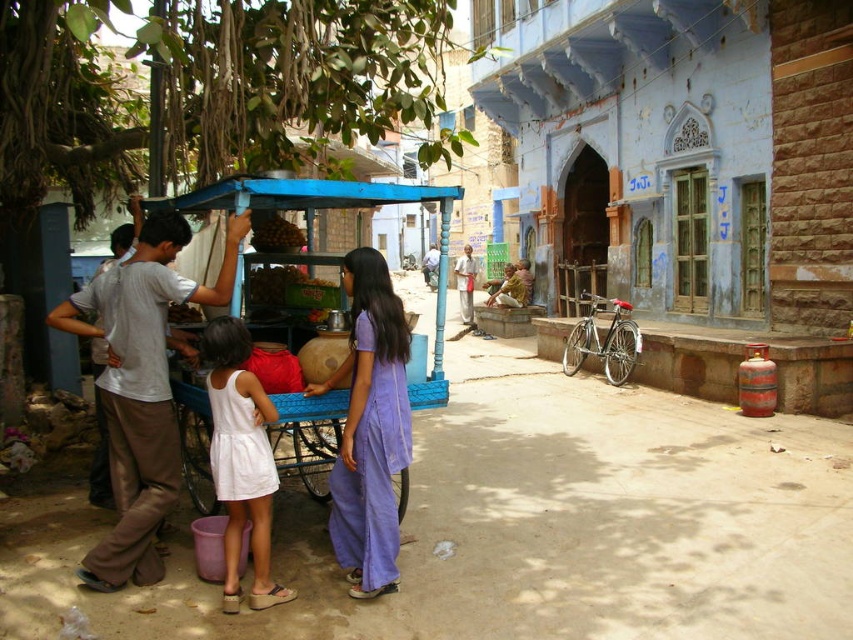
Is blue painted wood cart at center bigger than smooth brown nuts at center?

Yes.

Based on the photo, is blue painted wood cart at center above smooth brown nuts at center?

Correct, blue painted wood cart at center is located above smooth brown nuts at center.

This screenshot has width=853, height=640. What do you see at coordinates (305, 211) in the screenshot? I see `blue painted wood cart at center` at bounding box center [305, 211].

At what (x,y) coordinates should I click in order to perform the action: click on blue painted wood cart at center. Please return your answer as a coordinate pair (x, y). This screenshot has width=853, height=640. Looking at the image, I should click on (305, 211).

Who is lower down, white cotton shirt at left or purple cotton dress at center?

purple cotton dress at center

What are the coordinates of `white cotton shirt at left` in the screenshot? It's located at (141, 388).

Describe the element at coordinates (141, 388) in the screenshot. I see `white cotton shirt at left` at that location.

Where is `white cotton shirt at left`? white cotton shirt at left is located at coordinates (141, 388).

Measure the distance between purple cotton dress at center and camera.

purple cotton dress at center and camera are 3.96 meters apart from each other.

Is purple cotton dress at center to the left of smooth brown nuts at center from the viewer's perspective?

Incorrect, purple cotton dress at center is not on the left side of smooth brown nuts at center.

Identify the location of purple cotton dress at center. This screenshot has width=853, height=640. (370, 428).

This screenshot has height=640, width=853. I want to click on purple cotton dress at center, so click(370, 428).